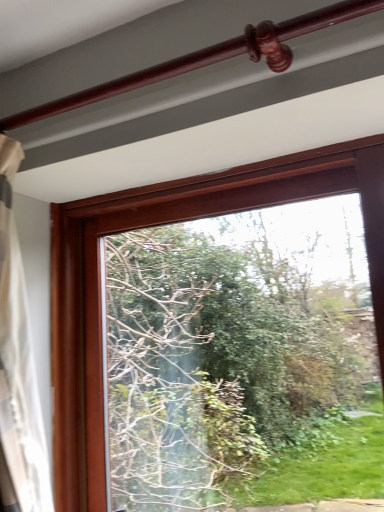
Question: In the image, is transparent glass window at center positioned in front of or behind glossy wood rail at upper center?

Choices:
 (A) behind
 (B) front

Answer: (A)

Question: From the image's perspective, is transparent glass window at center located above or below glossy wood rail at upper center?

Choices:
 (A) above
 (B) below

Answer: (B)

Question: Considering the positions of transparent glass window at center and glossy wood rail at upper center in the image, is transparent glass window at center taller or shorter than glossy wood rail at upper center?

Choices:
 (A) short
 (B) tall

Answer: (B)

Question: Do you think glossy wood rail at upper center is within transparent glass window at center, or outside of it?

Choices:
 (A) inside
 (B) outside

Answer: (B)

Question: Relative to transparent glass window at center, is glossy wood rail at upper center in front or behind?

Choices:
 (A) behind
 (B) front

Answer: (B)

Question: From the image's perspective, relative to transparent glass window at center, is glossy wood rail at upper center above or below?

Choices:
 (A) below
 (B) above

Answer: (B)

Question: Considering the positions of glossy wood rail at upper center and transparent glass window at center in the image, is glossy wood rail at upper center taller or shorter than transparent glass window at center?

Choices:
 (A) tall
 (B) short

Answer: (B)